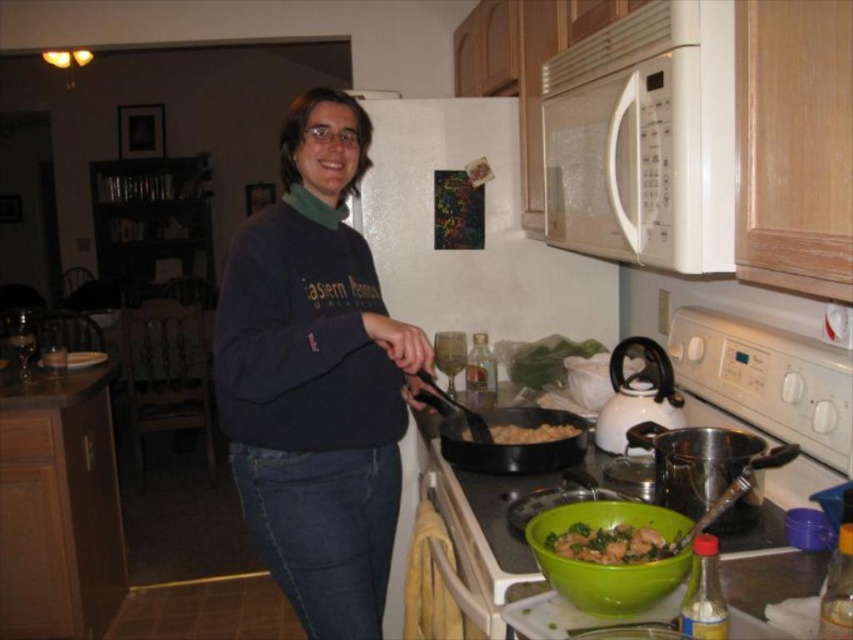
Can you confirm if dark blue sweater at center is bigger than green matte bowl at lower center?

Correct, dark blue sweater at center is larger in size than green matte bowl at lower center.

Who is positioned more to the left, dark blue sweater at center or green matte bowl at lower center?

From the viewer's perspective, dark blue sweater at center appears more on the left side.

Locate an element on the screen. This screenshot has width=853, height=640. dark blue sweater at center is located at coordinates (316, 378).

Is the position of black matte wok at center less distant than that of brown matte pan at center?

Yes, it is in front of brown matte pan at center.

Who is more forward, (x=454, y=454) or (x=500, y=440)?

Positioned in front is point (x=454, y=454).

This screenshot has height=640, width=853. What are the coordinates of `black matte wok at center` in the screenshot? It's located at (514, 444).

Between dark blue sweater at center and white matte microwave at upper center, which one has more height?

Standing taller between the two is dark blue sweater at center.

Which is in front, point (334, 604) or point (728, 154)?

Positioned in front is point (728, 154).

At what (x,y) coordinates should I click in order to perform the action: click on dark blue sweater at center. Please return your answer as a coordinate pair (x, y). The height and width of the screenshot is (640, 853). Looking at the image, I should click on (316, 378).